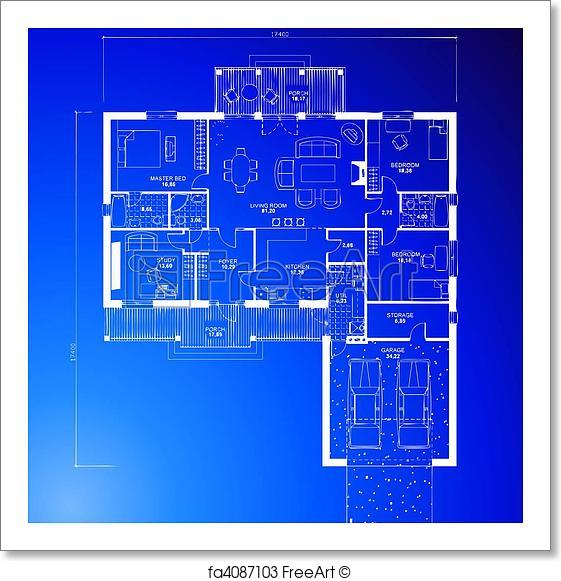
Image resolution: width=561 pixels, height=581 pixels. In order to click on storage in this screenshot , I will do `click(400, 317)`.